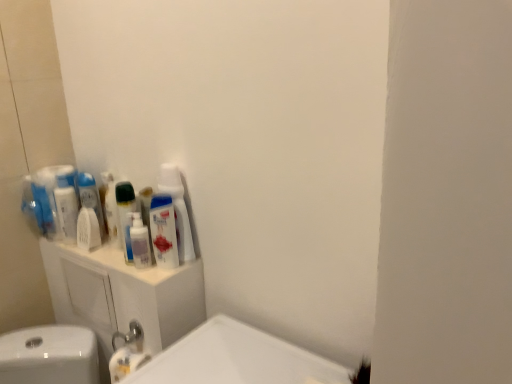
Question: Can you confirm if white glossy mouthwash at left, the fourth mouthwash positioned from the right, is positioned to the right of white glossy bottle at upper center?

Choices:
 (A) no
 (B) yes

Answer: (A)

Question: Is white glossy mouthwash at left, which ranks as the 2th mouthwash in left-to-right order, facing towards white glossy bottle at upper center?

Choices:
 (A) yes
 (B) no

Answer: (B)

Question: Does white glossy mouthwash at left, which ranks as the 2th mouthwash in left-to-right order, have a lesser height compared to white glossy bottle at upper center?

Choices:
 (A) yes
 (B) no

Answer: (A)

Question: Is white glossy mouthwash at left, the fourth mouthwash positioned from the right, facing away from white glossy bottle at upper center?

Choices:
 (A) yes
 (B) no

Answer: (B)

Question: From the image's perspective, is white glossy mouthwash at left, which ranks as the 2th mouthwash in left-to-right order, under white glossy bottle at upper center?

Choices:
 (A) yes
 (B) no

Answer: (B)

Question: Considering the relative positions of white glossy mouthwash at left, the fourth mouthwash positioned from the right, and white glossy bottle at upper center in the image provided, is white glossy mouthwash at left, the fourth mouthwash positioned from the right, behind white glossy bottle at upper center?

Choices:
 (A) no
 (B) yes

Answer: (B)

Question: From the image's perspective, is translucent plastic mouthwash at upper left, the 1th mouthwash viewed from the right, above white matte mouthwash at left, the 3th mouthwash when ordered from left to right?

Choices:
 (A) yes
 (B) no

Answer: (A)

Question: Is white matte mouthwash at left, placed as the 3th mouthwash when sorted from right to left, surrounded by translucent plastic mouthwash at upper left, which is the fifth mouthwash in left-to-right order?

Choices:
 (A) yes
 (B) no

Answer: (B)

Question: Considering the relative sizes of translucent plastic mouthwash at upper left, the 1th mouthwash viewed from the right, and white matte mouthwash at left, the 3th mouthwash when ordered from left to right, in the image provided, is translucent plastic mouthwash at upper left, the 1th mouthwash viewed from the right, bigger than white matte mouthwash at left, the 3th mouthwash when ordered from left to right,?

Choices:
 (A) yes
 (B) no

Answer: (A)

Question: Considering the relative positions of translucent plastic mouthwash at upper left, which is the fifth mouthwash in left-to-right order, and white matte mouthwash at left, placed as the 3th mouthwash when sorted from right to left, in the image provided, is translucent plastic mouthwash at upper left, which is the fifth mouthwash in left-to-right order, to the right of white matte mouthwash at left, placed as the 3th mouthwash when sorted from right to left, from the viewer's perspective?

Choices:
 (A) yes
 (B) no

Answer: (A)

Question: From a real-world perspective, is translucent plastic mouthwash at upper left, the 1th mouthwash viewed from the right, beneath white matte mouthwash at left, the 3th mouthwash when ordered from left to right?

Choices:
 (A) yes
 (B) no

Answer: (B)

Question: Is translucent plastic mouthwash at upper left, which is the fifth mouthwash in left-to-right order, placed right next to white matte mouthwash at left, placed as the 3th mouthwash when sorted from right to left?

Choices:
 (A) no
 (B) yes

Answer: (A)

Question: Considering the relative positions of white glossy bottle at upper center and white plastic cabinet at upper left in the image provided, is white glossy bottle at upper center behind white plastic cabinet at upper left?

Choices:
 (A) yes
 (B) no

Answer: (A)